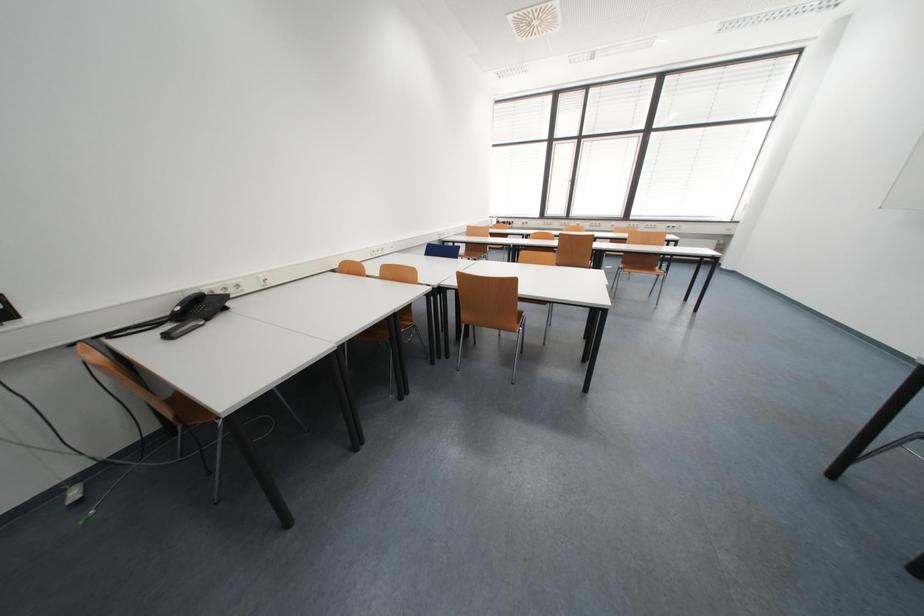
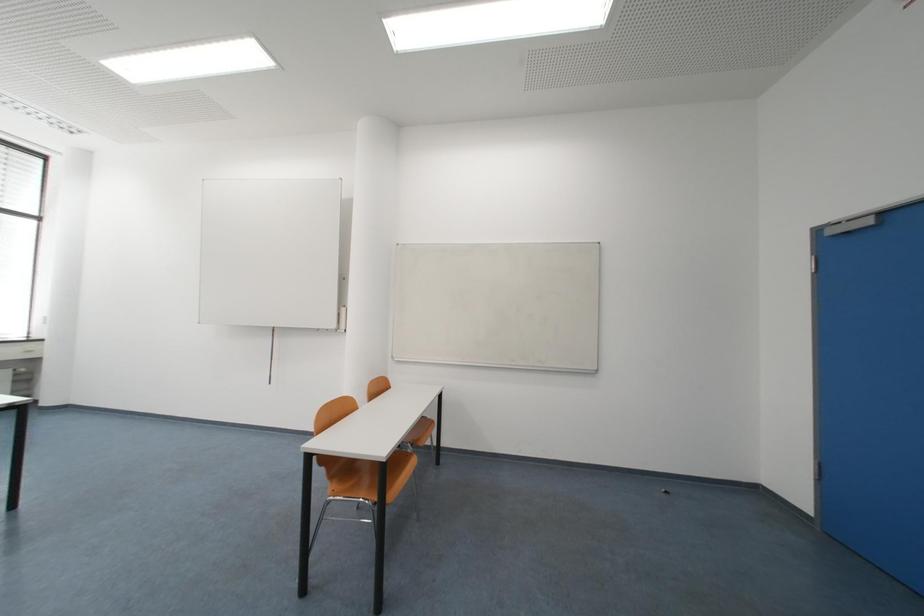
Question: The camera is either moving clockwise (left) or counter-clockwise (right) around the object. The first image is from the beginning of the video and the second image is from the end. Is the camera moving left or right when shooting the video?

Choices:
 (A) Left
 (B) Right

Answer: (A)